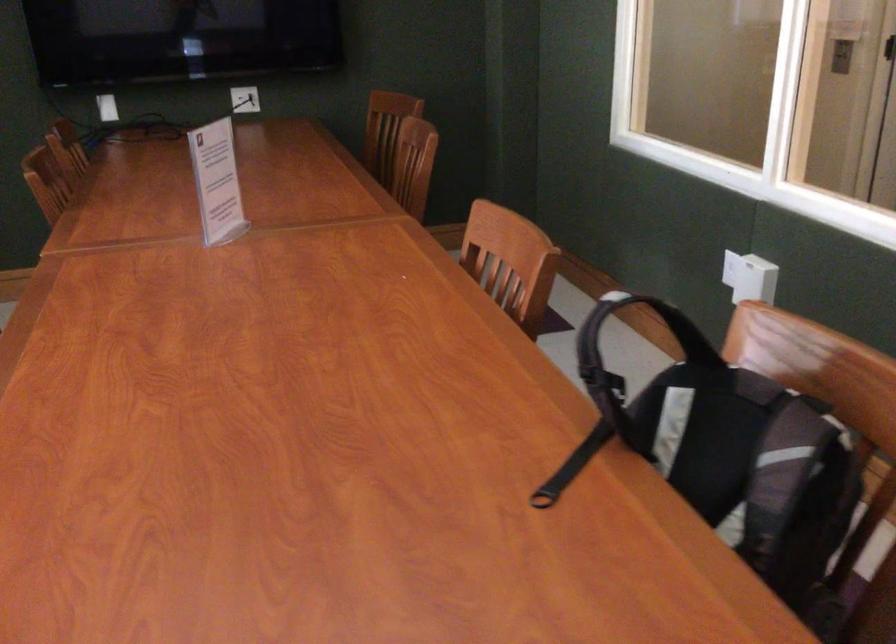
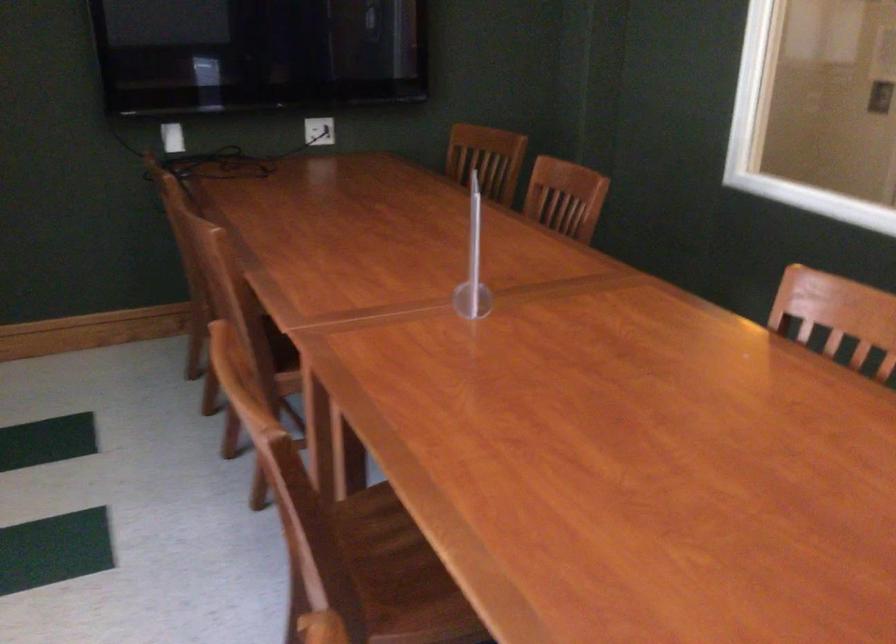
Find the pixel in the second image that matches point (277, 205) in the first image.

(472, 263)